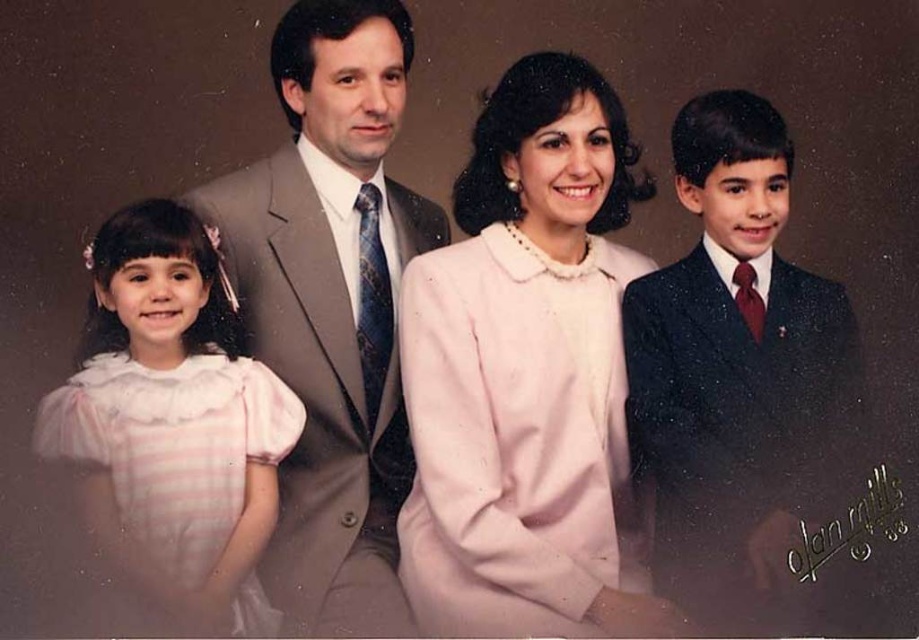
Is matte gray suit at center to the right of shiny dark blue suit at right from the viewer's perspective?

No, matte gray suit at center is not to the right of shiny dark blue suit at right.

Does point (422, 227) come behind point (749, 529)?

Yes, it is behind point (749, 529).

Where is `matte gray suit at center`? This screenshot has height=640, width=919. matte gray suit at center is located at coordinates (332, 307).

Identify the location of matte gray suit at center. (332, 307).

Can you confirm if pink satin blouse at center is thinner than shiny dark blue suit at right?

In fact, pink satin blouse at center might be wider than shiny dark blue suit at right.

Is pink satin blouse at center closer to camera compared to shiny dark blue suit at right?

No, it is not.

Which is behind, point (490, 497) or point (741, 630)?

Point (490, 497)

Locate an element on the screen. pink satin blouse at center is located at coordinates (526, 374).

Is matte gray suit at center positioned in front of pink satin dress at left?

No, it is behind pink satin dress at left.

Does matte gray suit at center have a lesser width compared to pink satin dress at left?

No, matte gray suit at center is not thinner than pink satin dress at left.

What do you see at coordinates (332, 307) in the screenshot? I see `matte gray suit at center` at bounding box center [332, 307].

Locate an element on the screen. Image resolution: width=919 pixels, height=640 pixels. matte gray suit at center is located at coordinates (332, 307).